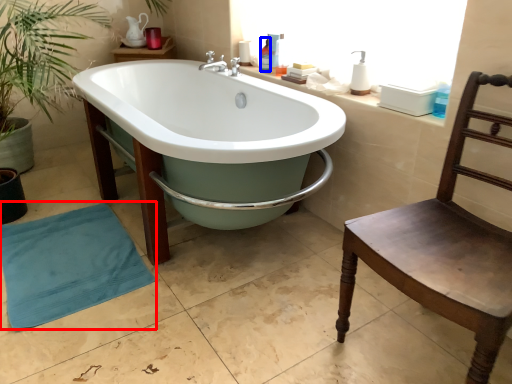
Question: Which object appears closest to the camera in this image, beach towel (highlighted by a red box) or toiletry (highlighted by a blue box)?

Choices:
 (A) beach towel
 (B) toiletry

Answer: (A)